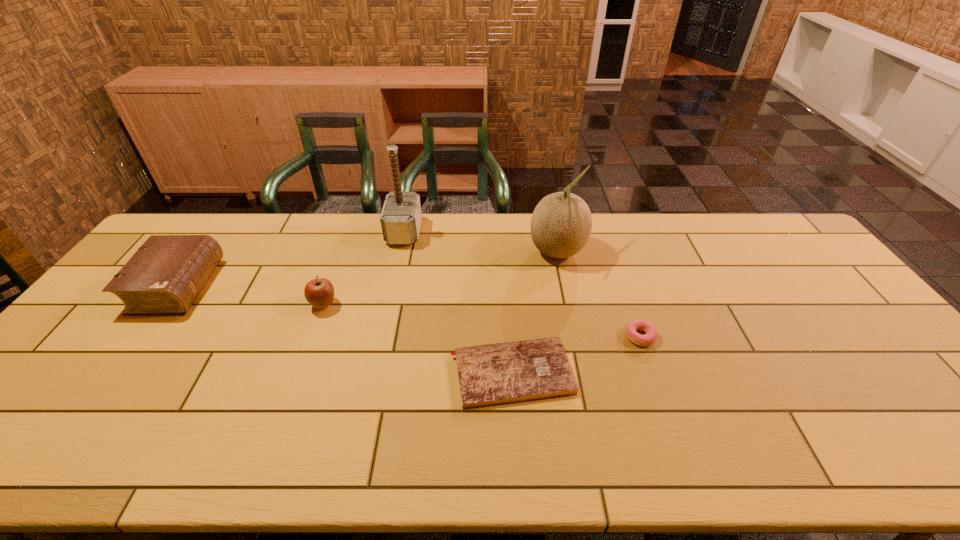
At what (x,y) coordinates should I click in order to perform the action: click on free region at the near edge. Please return your answer as a coordinate pair (x, y). This screenshot has height=540, width=960. Looking at the image, I should click on (889, 438).

At what (x,y) coordinates should I click in order to perform the action: click on vacant area at the left edge. Please return your answer as a coordinate pair (x, y). The image size is (960, 540). Looking at the image, I should click on (87, 347).

Where is `vacant space at the far left corner of the desktop`? The image size is (960, 540). vacant space at the far left corner of the desktop is located at coordinates point(198,213).

Locate an element on the screen. vacant space in between the shorter Bible and the cantaloup is located at coordinates (535, 313).

Where is `free point between the apple and the left Bible`? This screenshot has width=960, height=540. free point between the apple and the left Bible is located at coordinates (251, 295).

Where is `vacant space that's between the cantaloup and the farther Bible`? The height and width of the screenshot is (540, 960). vacant space that's between the cantaloup and the farther Bible is located at coordinates (368, 269).

This screenshot has height=540, width=960. Find the location of `vacant space that is in between the farther Bible and the second tallest object`. vacant space that is in between the farther Bible and the second tallest object is located at coordinates (368, 269).

In order to click on unoccupied position between the second shortest object and the cantaloup in this screenshot , I will do `click(598, 294)`.

In order to click on free space between the hammer and the shortest object in this screenshot , I will do `click(458, 302)`.

The image size is (960, 540). Identify the location of free space between the tallest object and the rightmost object. (522, 284).